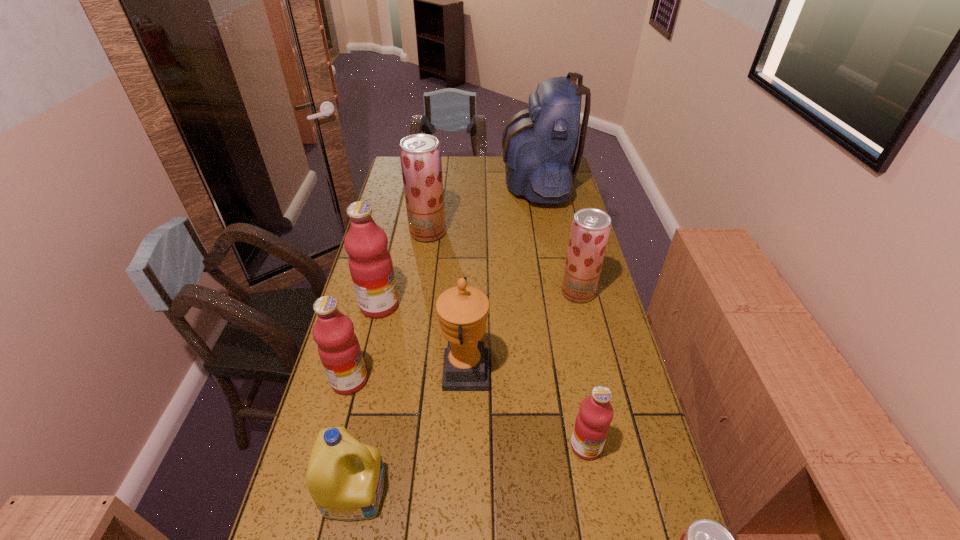
Identify which strawberry fruit juice is located as the second nearest to the second farthest strawberry fruit juice. Please provide its 2D coordinates. Your answer should be formatted as a tuple, i.e. [(x, y)], where the tuple contains the x and y coordinates of a point satisfying the conditions above.

[(704, 539)]

Locate which strawberry fruit juice ranks second in proximity to the nearest strawberry fruit juice. Please provide its 2D coordinates. Your answer should be formatted as a tuple, i.e. [(x, y)], where the tuple contains the x and y coordinates of a point satisfying the conditions above.

[(420, 154)]

Identify which pink fruit juice is located as the nearest to the biggest strawberry fruit juice. Please provide its 2D coordinates. Your answer should be formatted as a tuple, i.e. [(x, y)], where the tuple contains the x and y coordinates of a point satisfying the conditions above.

[(370, 263)]

Where is `pink fruit juice that is the second closest to the second nearest strawberry fruit juice`? This screenshot has width=960, height=540. pink fruit juice that is the second closest to the second nearest strawberry fruit juice is located at coordinates (370, 263).

Find the location of a particular element. The image size is (960, 540). vacant area in the image that satisfies the following two spatial constraints: 1. at the front pocket of the tallest object; 2. on the right side of the second smallest strawberry fruit juice is located at coordinates (557, 292).

At what (x,y) coordinates should I click in order to perform the action: click on free spot that satisfies the following two spatial constraints: 1. on the front side of the second farthest strawberry fruit juice; 2. on the label of the fourth farthest fruit juice. Please return your answer as a coordinate pair (x, y). Looking at the image, I should click on (599, 380).